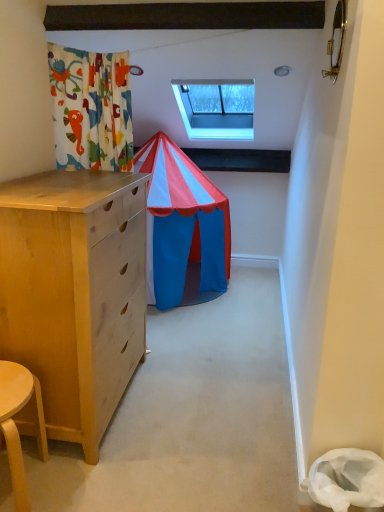
I want to click on transparent glass window at upper center, so click(216, 108).

The width and height of the screenshot is (384, 512). Describe the element at coordinates (216, 108) in the screenshot. I see `transparent glass window at upper center` at that location.

The height and width of the screenshot is (512, 384). What do you see at coordinates (15, 424) in the screenshot?
I see `light wood stool at lower left` at bounding box center [15, 424].

At what (x,y) coordinates should I click in order to perform the action: click on light wood stool at lower left. Please return your answer as a coordinate pair (x, y). Looking at the image, I should click on (15, 424).

Locate an element on the screen. transparent glass window at upper center is located at coordinates (216, 108).

In the image, is transparent glass window at upper center on the left side or the right side of light wood stool at lower left?

From the image, it's evident that transparent glass window at upper center is to the right of light wood stool at lower left.

Considering their positions, is transparent glass window at upper center located in front of or behind light wood stool at lower left?

Clearly, transparent glass window at upper center is behind light wood stool at lower left.

Does point (239, 136) appear closer or farther from the camera than point (8, 374)?

Clearly, point (239, 136) is more distant from the camera than point (8, 374).

From the image's perspective, relative to light wood stool at lower left, is transparent glass window at upper center above or below?

transparent glass window at upper center is above light wood stool at lower left.

From a real-world perspective, between transparent glass window at upper center and light wood stool at lower left, who is vertically higher?

From a 3D spatial view, transparent glass window at upper center is above.

Can you confirm if transparent glass window at upper center is wider than light wood stool at lower left?

Indeed, transparent glass window at upper center has a greater width compared to light wood stool at lower left.

In terms of height, does transparent glass window at upper center look taller or shorter compared to light wood stool at lower left?

Considering their sizes, transparent glass window at upper center has more height than light wood stool at lower left.

Can you confirm if transparent glass window at upper center is smaller than light wood stool at lower left?

Incorrect, transparent glass window at upper center is not smaller in size than light wood stool at lower left.

Is light wood stool at lower left surrounded by transparent glass window at upper center?

No, light wood stool at lower left is not surrounded by transparent glass window at upper center.

Is transparent glass window at upper center directly adjacent to light wood stool at lower left?

They are not placed beside each other.

Looking at this image, is light wood stool at lower left at the back of transparent glass window at upper center?

No, transparent glass window at upper center's orientation is not away from light wood stool at lower left.

How different are the orientations of transparent glass window at upper center and light wood stool at lower left in degrees?

transparent glass window at upper center and light wood stool at lower left are facing 9.17 degrees away from each other.

This screenshot has height=512, width=384. I want to click on table that appears in front of the transparent glass window at upper center, so click(x=15, y=424).

Considering the relative positions of light wood stool at lower left and transparent glass window at upper center in the image provided, is light wood stool at lower left to the left or to the right of transparent glass window at upper center?

In the image, light wood stool at lower left appears on the left side of transparent glass window at upper center.

Between light wood stool at lower left and transparent glass window at upper center, which one is positioned in front?

light wood stool at lower left is in front.

Is point (9, 425) closer to camera compared to point (189, 114)?

Yes, it is in front of point (189, 114).

From the image's perspective, which is below, light wood stool at lower left or transparent glass window at upper center?

From the image's view, light wood stool at lower left is below.

From a real-world perspective, which is physically above, light wood stool at lower left or transparent glass window at upper center?

In real-world perspective, transparent glass window at upper center is above.

Which object is thinner, light wood stool at lower left or transparent glass window at upper center?

→ With smaller width is light wood stool at lower left.

From the picture: Is light wood stool at lower left taller than transparent glass window at upper center?

Incorrect, the height of light wood stool at lower left is not larger of that of transparent glass window at upper center.

Which of these two, light wood stool at lower left or transparent glass window at upper center, is smaller?

Smaller between the two is light wood stool at lower left.

Is light wood stool at lower left located outside transparent glass window at upper center?

Yes, light wood stool at lower left is outside of transparent glass window at upper center.

Is light wood stool at lower left directly adjacent to transparent glass window at upper center?

No, light wood stool at lower left is not next to transparent glass window at upper center.

Is transparent glass window at upper center at the back of light wood stool at lower left?

light wood stool at lower left is not turned away from transparent glass window at upper center.

What's the angular difference between light wood stool at lower left and transparent glass window at upper center's facing directions?

They differ by 9.17 degrees in their facing directions.

How far apart are light wood stool at lower left and transparent glass window at upper center?

light wood stool at lower left is 2.51 meters away from transparent glass window at upper center.

You are a GUI agent. You are given a task and a screenshot of the screen. Output one action in this format:
    pyautogui.click(x=<x>, y=<y>)
    Task: Click on the table in front of the transparent glass window at upper center
    The height and width of the screenshot is (512, 384).
    Given the screenshot: What is the action you would take?
    (15, 424)

Locate an element on the screen. table that is in front of the transparent glass window at upper center is located at coordinates (15, 424).

In the image, there is a transparent glass window at upper center. Find the location of `table below it (from a real-world perspective)`. table below it (from a real-world perspective) is located at coordinates (15, 424).